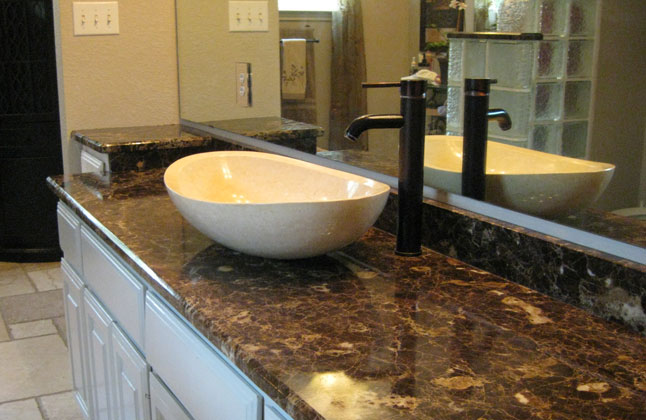
Image resolution: width=646 pixels, height=420 pixels. I want to click on cabinet doors, so click(158, 396), click(136, 381), click(101, 356), click(76, 334).